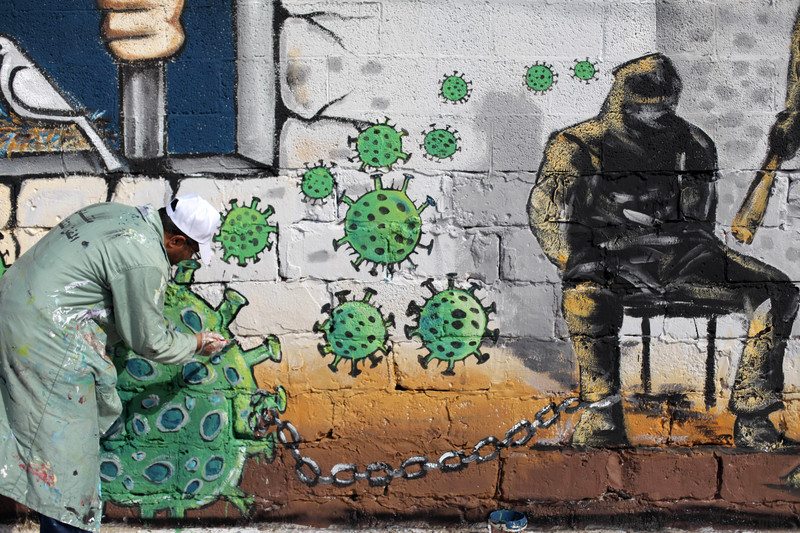
Where is `chair leg`? chair leg is located at coordinates (705, 365).